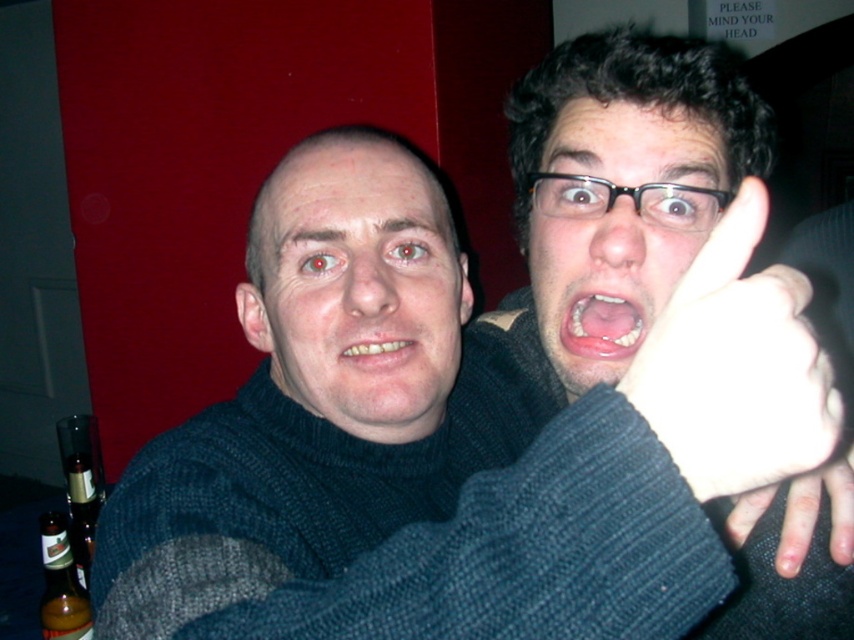
Does white matte hand at center have a greater width compared to yellowish matte teeth at center?

Yes.

Does white matte hand at center have a greater height compared to yellowish matte teeth at center?

Yes, white matte hand at center is taller than yellowish matte teeth at center.

At what (x,y) coordinates should I click in order to perform the action: click on white matte hand at center. Please return your answer as a coordinate pair (x, y). The image size is (854, 640). Looking at the image, I should click on (736, 365).

Who is positioned more to the left, matte black face at center or yellowish matte teeth at center?

Positioned to the left is matte black face at center.

Does point (382, 435) come closer to viewer compared to point (410, 346)?

No.

The height and width of the screenshot is (640, 854). I want to click on matte black face at center, so click(357, 288).

Can you confirm if matte black face at center is positioned to the left of pink glossy lips at center?

Indeed, matte black face at center is positioned on the left side of pink glossy lips at center.

Between matte black face at center and pink glossy lips at center, which one appears on the left side from the viewer's perspective?

matte black face at center

Who is more forward, (x=346, y=236) or (x=564, y=312)?

Positioned in front is point (x=346, y=236).

Locate an element on the screen. The height and width of the screenshot is (640, 854). matte black face at center is located at coordinates (357, 288).